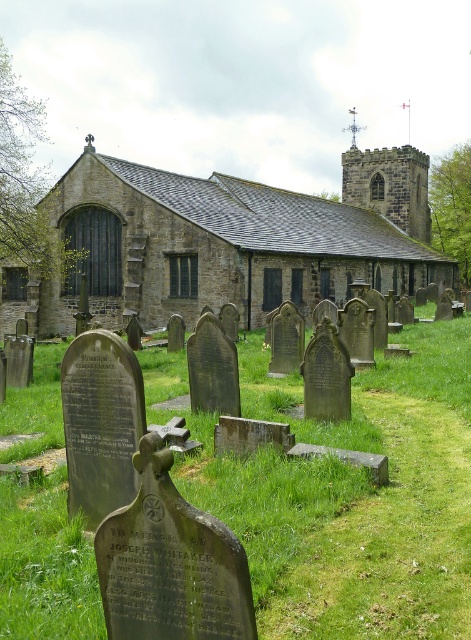
You are standing at the entrance of the traditional stone church and want to find the green grass at center. Based on the scene description, where should you look relative to the church?

The green grass at center is located at point (x=347, y=492), which means it is positioned to the lower right of the church. You should look towards the lower right direction from the church entrance to find the green grass at center.

You are planning to plant a new flowerbed in the green grass at center. Considering the space available, will there be enough room to place a large flowerbed that takes up more area than the brown stone church at center?

The green grass at center occupies less space than brown stone church at center, so there won not be enough room to place a large flowerbed that takes up more area than the brown stone church at center.

You are standing at the point marked by coordinates point [347,492]. Based on the scene description, what do you see directly below you?

The point [347,492] indicates green grass at center, so you are standing on green grass at center.